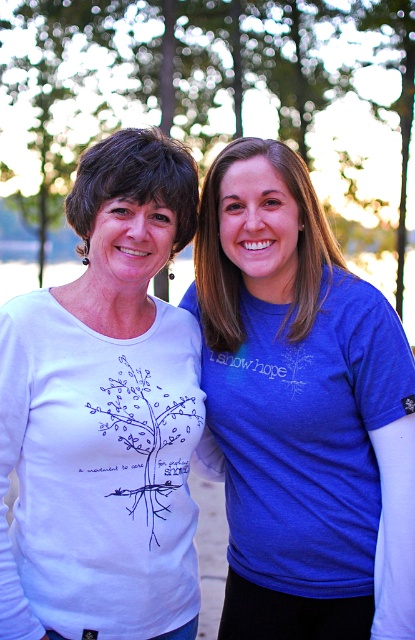
Does matte white shirt at left have a smaller size compared to white matte shirt at left?

No, matte white shirt at left is not smaller than white matte shirt at left.

Is matte white shirt at left closer to camera compared to white matte shirt at left?

No, it is behind white matte shirt at left.

Between point (293, 420) and point (49, 298), which one is positioned in front?

Positioned in front is point (49, 298).

Locate an element on the screen. This screenshot has width=415, height=640. matte white shirt at left is located at coordinates (302, 410).

Looking at this image, can you confirm if white matte shirt at left is smaller than white matte tree at center?

Yes.

Describe the element at coordinates (104, 413) in the screenshot. I see `white matte shirt at left` at that location.

This screenshot has height=640, width=415. What are the coordinates of `white matte shirt at left` in the screenshot? It's located at (104, 413).

From the picture: Can you confirm if matte white shirt at left is smaller than white matte tree at center?

Indeed, matte white shirt at left has a smaller size compared to white matte tree at center.

Is matte white shirt at left to the left of white matte tree at center from the viewer's perspective?

No, matte white shirt at left is not to the left of white matte tree at center.

Which is behind, point (232, 145) or point (217, 144)?

The point (217, 144) is behind.

The width and height of the screenshot is (415, 640). In order to click on matte white shirt at left in this screenshot , I will do `click(302, 410)`.